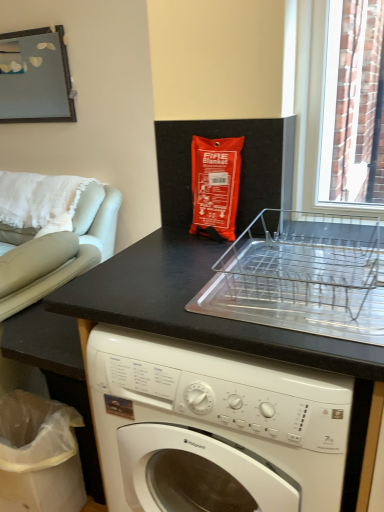
I want to click on free space that is to the left of clear plastic dish rack at center, so click(161, 287).